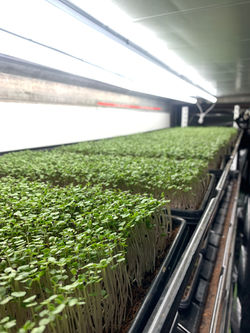
You are a GUI agent. You are given a task and a screenshot of the screen. Output one action in this format:
    pyautogui.click(x=<x>, y=<y>)
    Task: Click on the lamp
    
    Given the screenshot: What is the action you would take?
    click(x=18, y=10)